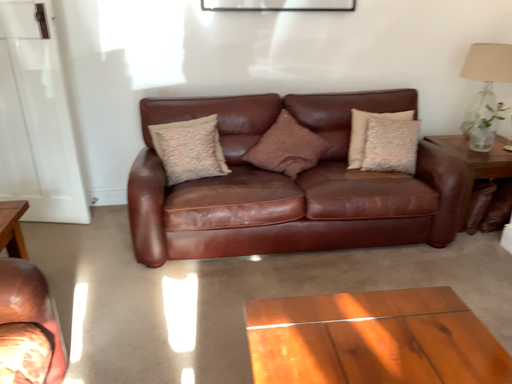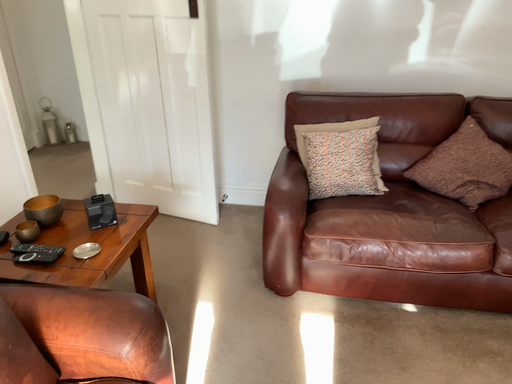
Question: How did the camera likely rotate when shooting the video?

Choices:
 (A) rotated left
 (B) rotated right

Answer: (A)